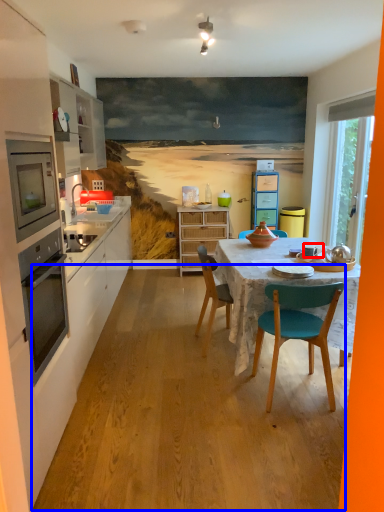
Question: Which point is further to the camera, coffee cup (highlighted by a red box) or plywood (highlighted by a blue box)?

Choices:
 (A) coffee cup
 (B) plywood

Answer: (A)